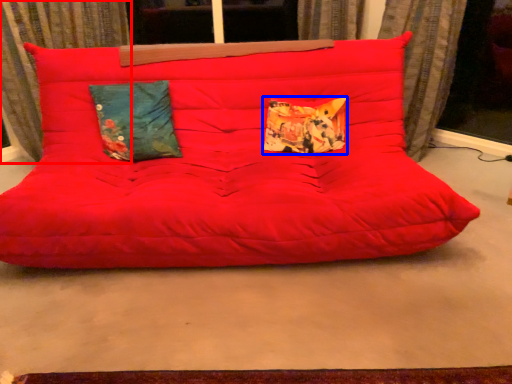
Question: Which point is further to the camera, curtain (highlighted by a red box) or pillow (highlighted by a blue box)?

Choices:
 (A) curtain
 (B) pillow

Answer: (B)